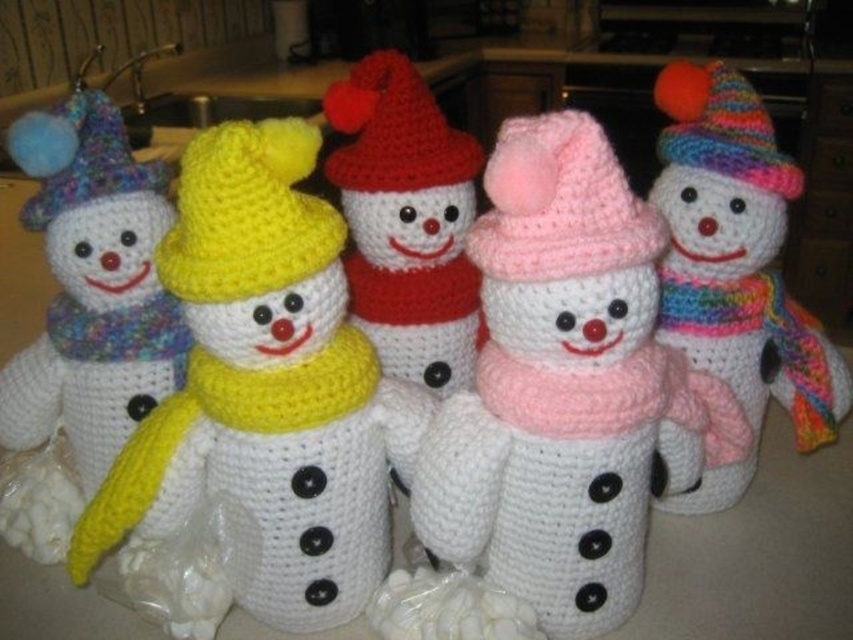
Question: Which of the following is the farthest from the observer?

Choices:
 (A) multicolored yarn snowman at center
 (B) multicolored yarn hat at left
 (C) multicolored knitted hat at upper right

Answer: (C)

Question: Does yellow yarn hat at center come in front of red yarn hat at center?

Choices:
 (A) yes
 (B) no

Answer: (A)

Question: Among these points, which one is farthest from the camera?

Choices:
 (A) (746, 177)
 (B) (403, 83)

Answer: (B)

Question: Can you confirm if pink yarn snowman at center is bigger than red yarn hat at center?

Choices:
 (A) no
 (B) yes

Answer: (B)

Question: Does pink knitted hat at center have a larger size compared to red yarn hat at center?

Choices:
 (A) yes
 (B) no

Answer: (B)

Question: Which of the following is the closest to the observer?

Choices:
 (A) (96, 344)
 (B) (158, 476)

Answer: (B)